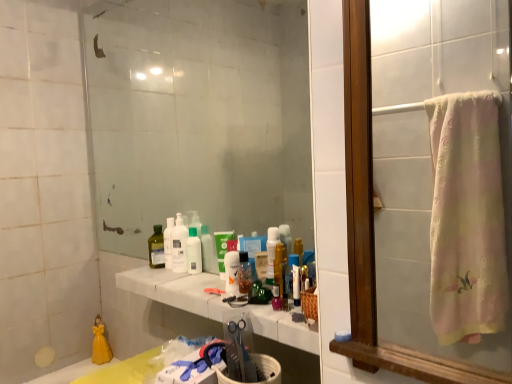
Identify the location of free space above white marble counter at center (from a real-world perspective). (219, 288).